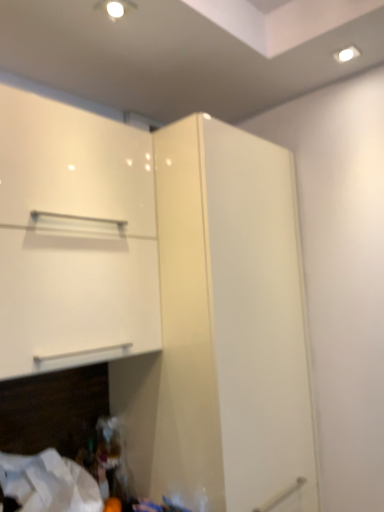
Question: Is glossy white cupboard at upper center further to camera compared to white glossy cabinet at upper left?

Choices:
 (A) yes
 (B) no

Answer: (B)

Question: Could you tell me if glossy white cupboard at upper center is facing white glossy cabinet at upper left?

Choices:
 (A) yes
 (B) no

Answer: (A)

Question: Is glossy white cupboard at upper center thinner than white glossy cabinet at upper left?

Choices:
 (A) no
 (B) yes

Answer: (B)

Question: From the image's perspective, does glossy white cupboard at upper center appear higher than white glossy cabinet at upper left?

Choices:
 (A) no
 (B) yes

Answer: (A)

Question: Is glossy white cupboard at upper center directly adjacent to white glossy cabinet at upper left?

Choices:
 (A) yes
 (B) no

Answer: (B)

Question: Looking at their shapes, would you say white glossy cabinet at upper left is wider or thinner than white fabric at lower left?

Choices:
 (A) wide
 (B) thin

Answer: (A)

Question: Is point (59, 291) positioned closer to the camera than point (64, 484)?

Choices:
 (A) closer
 (B) farther

Answer: (A)

Question: From a real-world perspective, relative to white fabric at lower left, is white glossy cabinet at upper left vertically above or below?

Choices:
 (A) below
 (B) above

Answer: (B)

Question: From their relative heights in the image, would you say white glossy cabinet at upper left is taller or shorter than white fabric at lower left?

Choices:
 (A) tall
 (B) short

Answer: (A)

Question: Based on their sizes in the image, would you say white fabric at lower left is bigger or smaller than glossy white cupboard at upper center?

Choices:
 (A) small
 (B) big

Answer: (A)

Question: From the image's perspective, is white fabric at lower left located above or below glossy white cupboard at upper center?

Choices:
 (A) above
 (B) below

Answer: (B)

Question: Is white fabric at lower left taller or shorter than glossy white cupboard at upper center?

Choices:
 (A) short
 (B) tall

Answer: (A)

Question: Based on their positions, is white fabric at lower left located to the left or right of glossy white cupboard at upper center?

Choices:
 (A) left
 (B) right

Answer: (A)

Question: From the image's perspective, is glossy white cupboard at upper center above or below white fabric at lower left?

Choices:
 (A) above
 (B) below

Answer: (A)

Question: Visually, is glossy white cupboard at upper center positioned to the left or to the right of white fabric at lower left?

Choices:
 (A) left
 (B) right

Answer: (B)